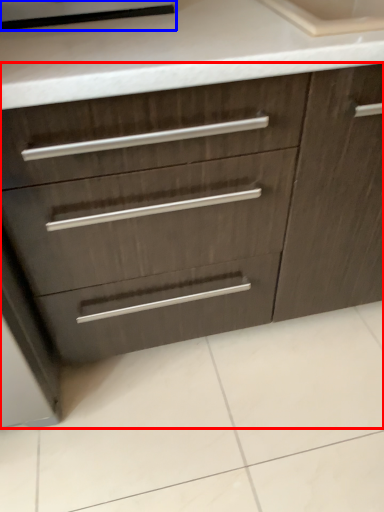
Question: Among these objects, which one is farthest to the camera, chest of drawers (highlighted by a red box) or appliance (highlighted by a blue box)?

Choices:
 (A) chest of drawers
 (B) appliance

Answer: (B)